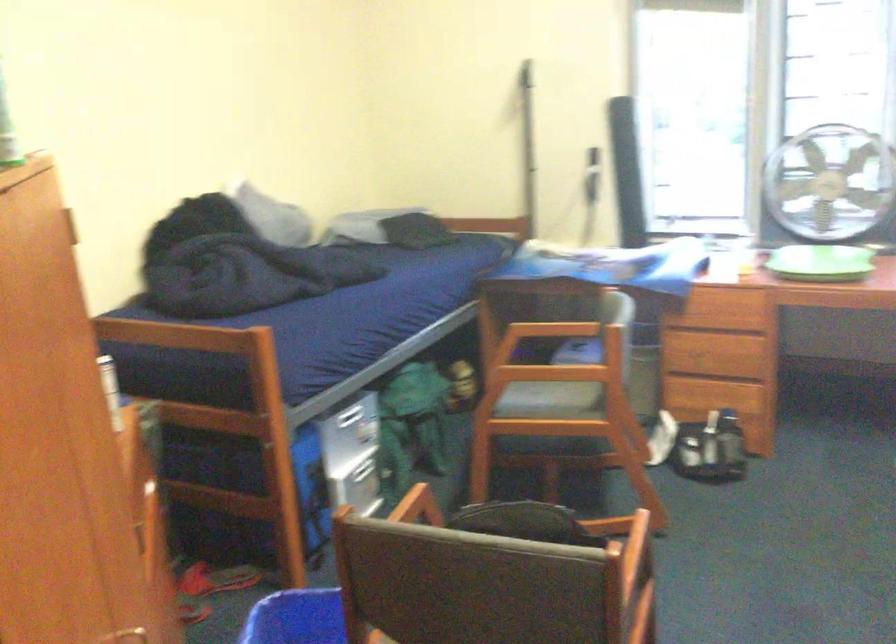
The height and width of the screenshot is (644, 896). I want to click on blue plastic bin, so click(297, 618).